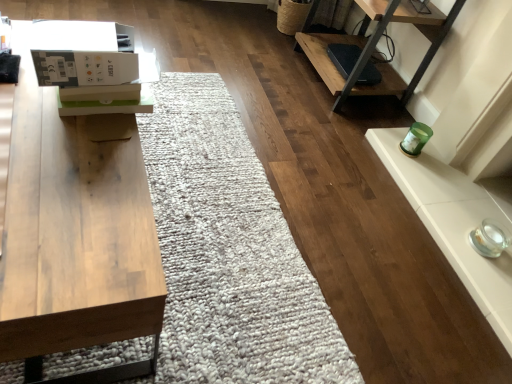
Identify the location of vacant space behind wooden table at left. tap(193, 142).